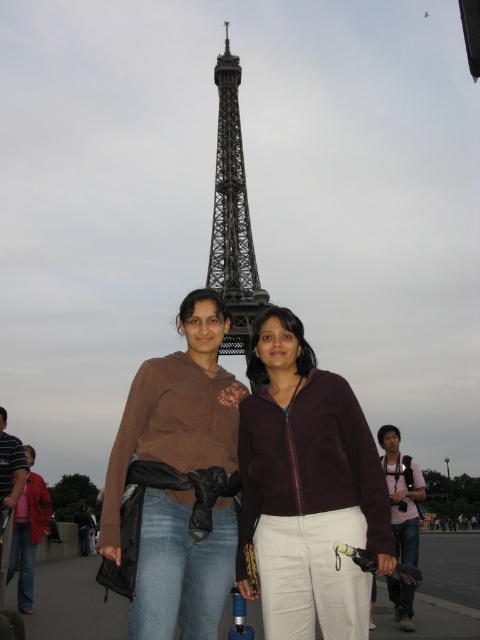
Question: Does purple fleece jacket at center lie in front of brushed metal jacket at lower left?

Choices:
 (A) yes
 (B) no

Answer: (A)

Question: Can you confirm if black metal eiffel tower at center is positioned above pink fabric bag at center?

Choices:
 (A) no
 (B) yes

Answer: (B)

Question: Estimate the real-world distances between objects in this image. Which object is farther from the brown soft hoodie at center?

Choices:
 (A) matte brown jacket at center
 (B) pink fabric bag at center
 (C) purple fleece jacket at center

Answer: (B)

Question: Is brushed metal jacket at lower left to the left of matte brown jacket at center from the viewer's perspective?

Choices:
 (A) yes
 (B) no

Answer: (A)

Question: Which point is closer to the camera?

Choices:
 (A) (116, 502)
 (B) (249, 438)
 (C) (33, 508)

Answer: (A)

Question: Considering the real-world distances, which object is closest to the pink fabric bag at center?

Choices:
 (A) black metal eiffel tower at center
 (B) brown soft hoodie at center
 (C) matte brown jacket at center
 (D) brushed metal jacket at lower left

Answer: (C)